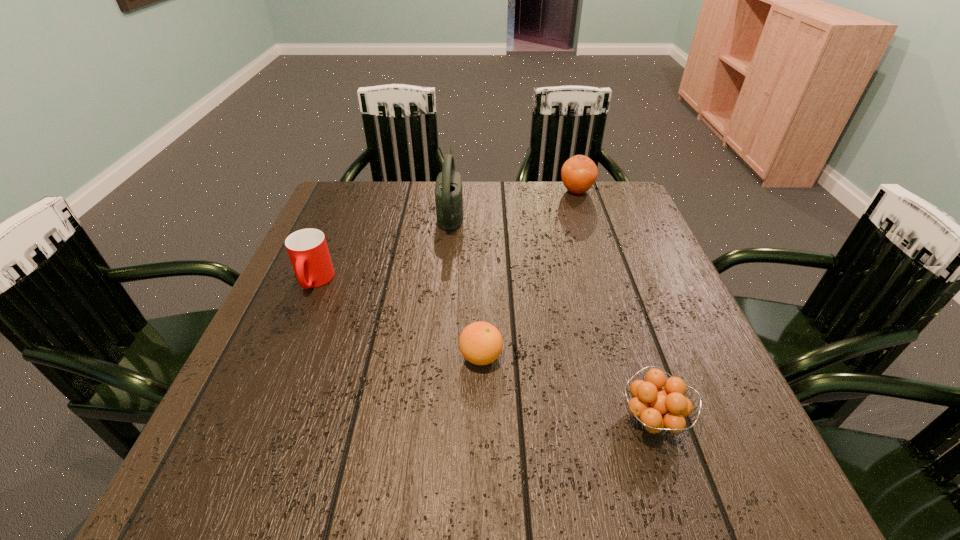
At what (x,y) coordinates should I click in order to perform the action: click on vacant space located 0.310m on the side of the third farthest object with the handle. Please return your answer as a coordinate pair (x, y). The width and height of the screenshot is (960, 540). Looking at the image, I should click on (252, 426).

At what (x,y) coordinates should I click in order to perform the action: click on free point located 0.210m on the left of the nearest object. Please return your answer as a coordinate pair (x, y). This screenshot has height=540, width=960. Looking at the image, I should click on (494, 420).

Where is `vacant space situated on the back of the fourth farthest object`? The height and width of the screenshot is (540, 960). vacant space situated on the back of the fourth farthest object is located at coordinates (481, 262).

This screenshot has height=540, width=960. Identify the location of watering can situated at the far edge. (448, 188).

The height and width of the screenshot is (540, 960). What are the coordinates of `orange present at the far edge` in the screenshot? It's located at (579, 173).

At what (x,y) coordinates should I click in order to perform the action: click on object that is at the near edge. Please return your answer as a coordinate pair (x, y). This screenshot has height=540, width=960. Looking at the image, I should click on point(657,408).

Locate an element on the screen. This screenshot has height=540, width=960. object that is at the left edge is located at coordinates (307, 248).

Where is `object at the far right corner`? The width and height of the screenshot is (960, 540). object at the far right corner is located at coordinates (579, 173).

Identify the location of object present at the near right corner. (657, 408).

The width and height of the screenshot is (960, 540). I want to click on vacant space at the far edge of the desktop, so click(x=532, y=201).